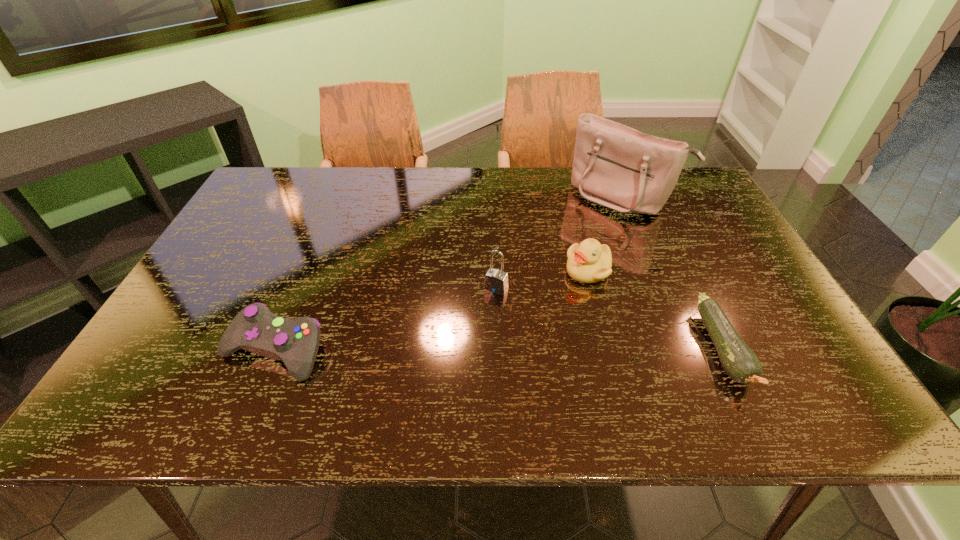
Where is `empty space that is in between the zucchini and the control`? empty space that is in between the zucchini and the control is located at coordinates (498, 349).

This screenshot has height=540, width=960. Identify the location of empty space between the tallest object and the fourth shortest object. (559, 242).

This screenshot has width=960, height=540. Identify the location of the closest object to the shoulder bag. (588, 262).

Where is `object that is the second closest to the fourth shortest object`? object that is the second closest to the fourth shortest object is located at coordinates (616, 166).

Image resolution: width=960 pixels, height=540 pixels. What are the coordinates of `vacant region that satisfies the following two spatial constraints: 1. on the back side of the control; 2. on the left side of the fourth shortest object` in the screenshot? It's located at (300, 288).

Where is `free spot that satisfies the following two spatial constraints: 1. on the back side of the fourth shortest object; 2. on the left side of the shoulder bag`? free spot that satisfies the following two spatial constraints: 1. on the back side of the fourth shortest object; 2. on the left side of the shoulder bag is located at coordinates (492, 197).